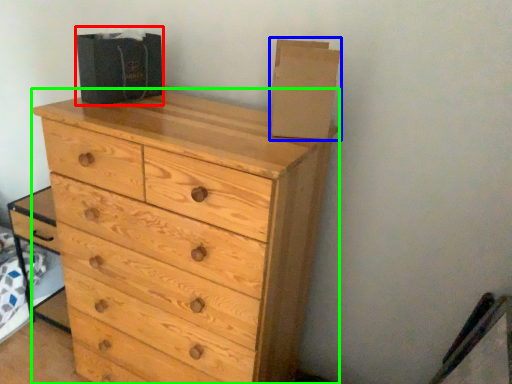
Question: Which object is positioned closest to cardboard box (highlighted by a red box)? Select from cardboard box (highlighted by a blue box) and chest of drawers (highlighted by a green box).

Choices:
 (A) cardboard box
 (B) chest of drawers

Answer: (B)